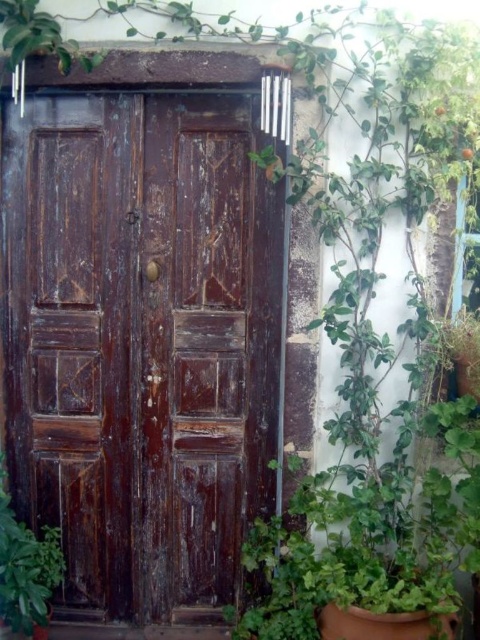
Question: Does weathered wood door at center have a smaller size compared to green leafy plant at lower left?

Choices:
 (A) no
 (B) yes

Answer: (A)

Question: Is weathered wood door at center to the left of green leafy plant at lower left from the viewer's perspective?

Choices:
 (A) yes
 (B) no

Answer: (B)

Question: Which point is farther to the camera?

Choices:
 (A) weathered wood door at center
 (B) green leafy plant at lower left

Answer: (A)

Question: Does weathered wood door at center appear on the left side of green leafy plant at lower left?

Choices:
 (A) no
 (B) yes

Answer: (A)

Question: Which of the following is the farthest from the observer?

Choices:
 (A) green leafy plant at lower left
 (B) weathered wood door at center

Answer: (B)

Question: Which point is closer to the camera taking this photo?

Choices:
 (A) (12, 600)
 (B) (211, 616)

Answer: (A)